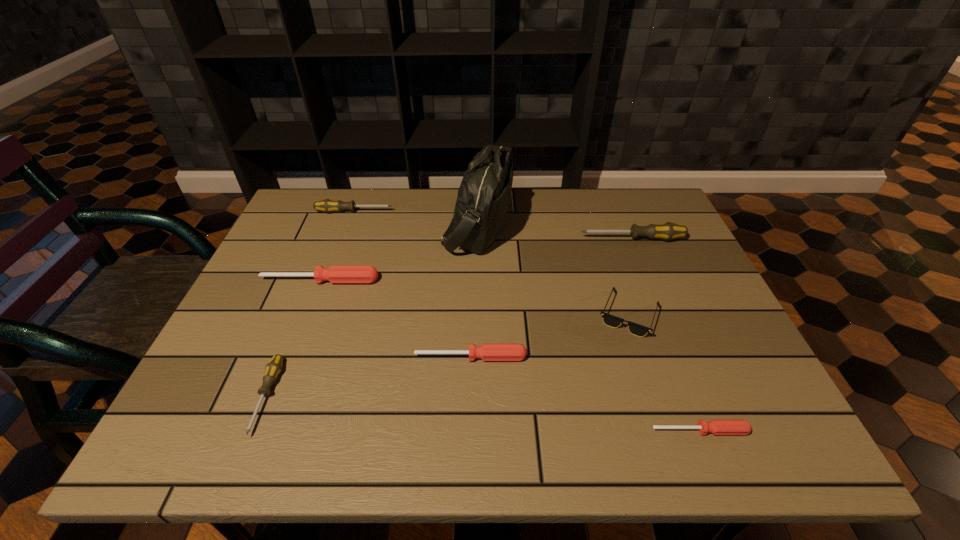
What are the coordinates of `vacant region located 0.150m on the lenses of the black sunglasses` in the screenshot? It's located at (658, 400).

Where is `vacant area situated 0.140m on the front of the second red screwdriver from left to right`? The image size is (960, 540). vacant area situated 0.140m on the front of the second red screwdriver from left to right is located at coordinates (469, 424).

I want to click on vacant point located 0.200m on the left of the shortest object, so click(x=545, y=430).

Identify the location of shoulder bag at the far edge. (483, 198).

You are a GUI agent. You are given a task and a screenshot of the screen. Output one action in this format:
    pyautogui.click(x=<x>, y=<y>)
    Task: Click on the sunglasses that is at the right edge
    
    Given the screenshot: What is the action you would take?
    pyautogui.click(x=610, y=320)

Find the location of a particular element. object that is at the far left corner is located at coordinates (327, 205).

Find the location of a particular element. This screenshot has height=540, width=960. object present at the near left corner is located at coordinates (274, 367).

What are the coordinates of `object at the far right corner` in the screenshot? It's located at (667, 231).

At what (x,y) coordinates should I click in order to perform the action: click on object that is at the near right corner. Please return your answer as a coordinate pair (x, y). The image size is (960, 540). Looking at the image, I should click on (716, 426).

In order to click on free spot at the far edge of the desktop in this screenshot , I will do `click(360, 225)`.